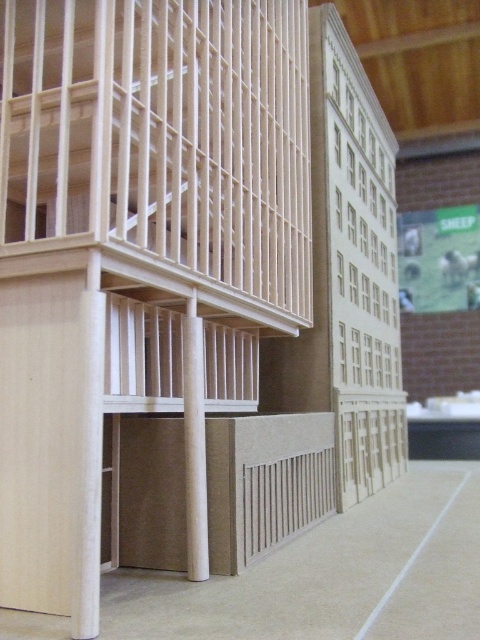
You are a child who wants to play hide and seek in this model barn. You can choose to hide behind either the light wood bunk bed at left or the matte wood pillar at center. Which hiding spot is closer to the other object?

The light wood bunk bed at left is 34.50 inches away from the matte wood pillar at center, so both hiding spots are the same distance from each other.

You are a parent setting up a child room. You have a light wood bunk bed at left and a matte wood pillar at center. Which object takes up more space in the room?

The light wood bunk bed at left is bigger than the matte wood pillar at center, so it takes up more space in the room.